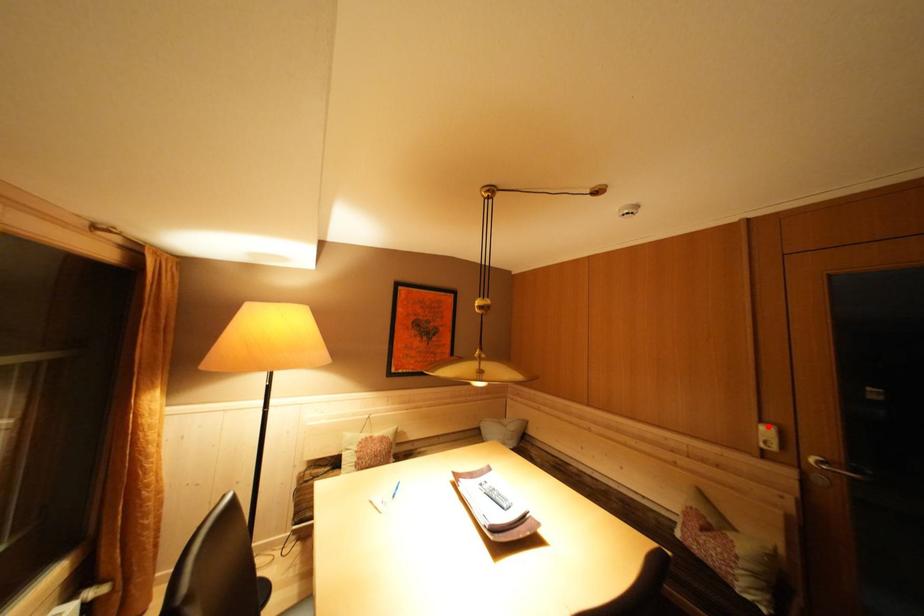
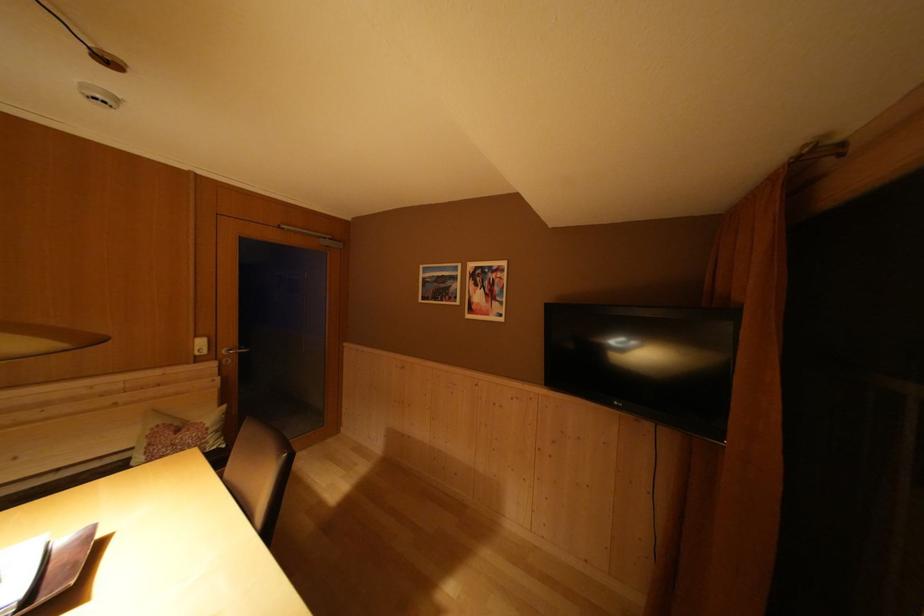
Where in the second image is the point corresponding to the highlighted location from the first image?

(203, 342)